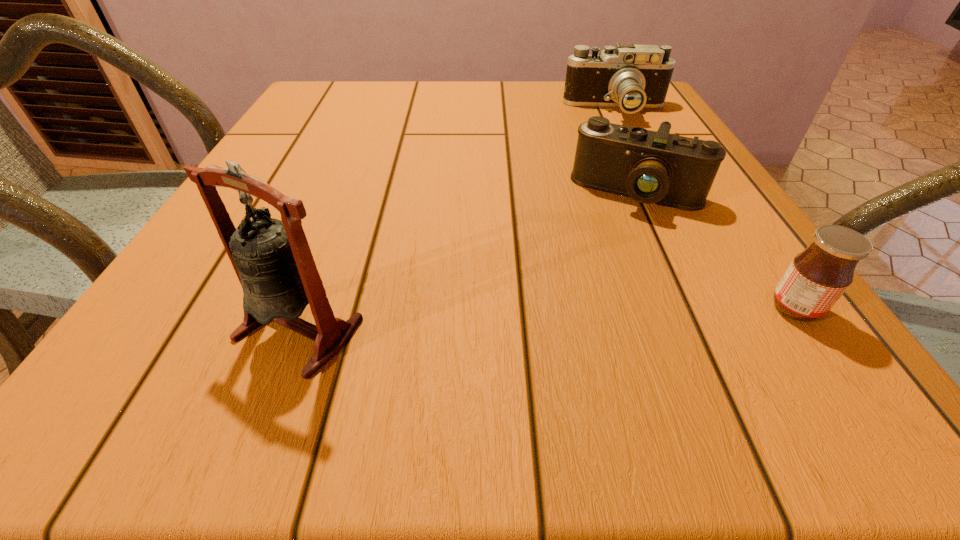
Image resolution: width=960 pixels, height=540 pixels. In the image, there is a desktop. What are the coordinates of `vacant region at the far edge` in the screenshot? It's located at click(x=574, y=116).

Locate an element on the screen. vacant region at the near edge of the desktop is located at coordinates (462, 319).

In the image, there is a desktop. In order to click on free region at the left edge in this screenshot , I will do `click(281, 125)`.

In the image, there is a desktop. Identify the location of vacant region at the right edge. (672, 234).

Image resolution: width=960 pixels, height=540 pixels. What are the coordinates of `free region at the far left corner of the desktop` in the screenshot? It's located at (324, 94).

In the image, there is a desktop. Identify the location of vacant space at the near left corner. (199, 317).

Identify the location of free space between the jam and the leftmost object. This screenshot has height=540, width=960. (547, 319).

Find the location of `vacant area that lies between the jam and the farthest object`. vacant area that lies between the jam and the farthest object is located at coordinates (706, 210).

Identify the location of vacant space in between the jam and the second farthest object. (716, 251).

The height and width of the screenshot is (540, 960). I want to click on empty space between the nearer camera and the bell, so click(468, 261).